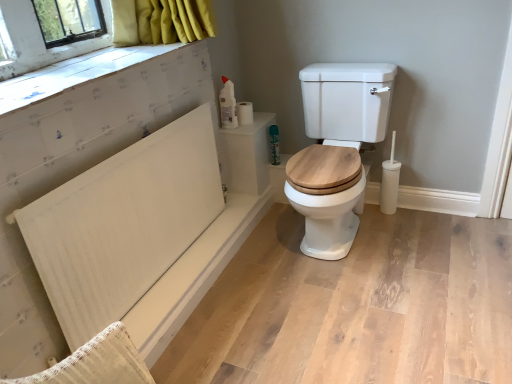
Measure the distance between point (73,70) and camera.

Point (73,70) is 5.11 feet away from camera.

The height and width of the screenshot is (384, 512). What are the coordinates of `white wood toilet at center` in the screenshot? It's located at (337, 150).

Is point (312, 246) more distant than point (98, 208)?

Yes.

Who is taller, white wood toilet at center or white textured radiator at left?

white wood toilet at center.

Considering the relative positions of white wood toilet at center and white textured radiator at left in the image provided, is white wood toilet at center to the left or to the right of white textured radiator at left?

In the image, white wood toilet at center appears on the right side of white textured radiator at left.

Is white wood toilet at center inside or outside of white textured radiator at left?

white wood toilet at center is spatially situated outside white textured radiator at left.

Considering the sizes of white textured board at upper left and white matte toilet paper at upper right, acting as the 1th toilet paper starting from the left, in the image, is white textured board at upper left bigger or smaller than white matte toilet paper at upper right, acting as the 1th toilet paper starting from the left,?

Clearly, white textured board at upper left is larger in size than white matte toilet paper at upper right, acting as the 1th toilet paper starting from the left.

Considering the relative positions of white textured board at upper left and white matte toilet paper at upper right, acting as the 1th toilet paper starting from the left, in the image provided, is white textured board at upper left to the right of white matte toilet paper at upper right, acting as the 1th toilet paper starting from the left, from the viewer's perspective?

No, white textured board at upper left is not to the right of white matte toilet paper at upper right, acting as the 1th toilet paper starting from the left.

Which object is further away from the camera taking this photo, white textured board at upper left or white matte toilet paper at upper right, acting as the 1th toilet paper starting from the left?

white matte toilet paper at upper right, acting as the 1th toilet paper starting from the left, is further from the camera.

Is white textured board at upper left not near white matte toilet paper at upper right, arranged as the second toilet paper when viewed from the right?

No, there isn't a large distance between white textured board at upper left and white matte toilet paper at upper right, arranged as the second toilet paper when viewed from the right.

From the image's perspective, relative to white textured board at upper left, is white matte toilet paper at upper right, which ranks as the second toilet paper in left-to-right order, above or below?

Based on their image positions, white matte toilet paper at upper right, which ranks as the second toilet paper in left-to-right order, is located beneath white textured board at upper left.

Based on the photo, what's the angular difference between white matte toilet paper at upper right, the 1th toilet paper viewed from the right, and white textured board at upper left's facing directions?

0.149 degrees.

This screenshot has height=384, width=512. Identify the location of window sill that is above the white matte toilet paper at upper right, which ranks as the second toilet paper in left-to-right order (from the image's perspective). (74, 74).

Is white matte toilet paper at upper right, which ranks as the second toilet paper in left-to-right order, not near white textured board at upper left?

No, white matte toilet paper at upper right, which ranks as the second toilet paper in left-to-right order, is in close proximity to white textured board at upper left.

Which point is more distant from viewer, (166, 313) or (67, 66)?

The point (166, 313) is behind.

From the image's perspective, is white matte bath at lower left above or below white textured board at upper left?

white matte bath at lower left is below white textured board at upper left.

Which of these two, white matte bath at lower left or white textured board at upper left, is wider?

Wider between the two is white textured board at upper left.

From a real-world perspective, is white matte bath at lower left above or below white textured board at upper left?

From a real-world perspective, white matte bath at lower left is physically below white textured board at upper left.

From the image's perspective, which is below, white textured board at upper left or white matte bath at lower left?

white matte bath at lower left.

Considering their positions, is white textured board at upper left located in front of or behind white matte bath at lower left?

white textured board at upper left is positioned closer to the viewer than white matte bath at lower left.

Is white textured board at upper left spatially inside white matte bath at lower left, or outside of it?

white textured board at upper left is located beyond the bounds of white matte bath at lower left.

Is white textured board at upper left aimed at white matte bath at lower left?

No, white textured board at upper left is not oriented towards white matte bath at lower left.

From the image's perspective, is white matte toilet paper at upper right, which ranks as the second toilet paper in left-to-right order, located above white matte bath at lower left?

Yes, from the image's perspective, white matte toilet paper at upper right, which ranks as the second toilet paper in left-to-right order, is on top of white matte bath at lower left.

From the picture: Does white matte toilet paper at upper right, the 1th toilet paper viewed from the right, appear on the right side of white matte bath at lower left?

Indeed, white matte toilet paper at upper right, the 1th toilet paper viewed from the right, is positioned on the right side of white matte bath at lower left.

From a real-world perspective, is white matte toilet paper at upper right, which ranks as the second toilet paper in left-to-right order, on white matte bath at lower left?

Indeed, from a real-world perspective, white matte toilet paper at upper right, which ranks as the second toilet paper in left-to-right order, stands above white matte bath at lower left.

Is white matte toilet paper at upper right, arranged as the second toilet paper when viewed from the right, taller than white textured board at upper left?

Yes.

Locate an element on the screen. This screenshot has height=384, width=512. toilet paper that is the 1st object directly below the white textured board at upper left (from a real-world perspective) is located at coordinates (233, 107).

In terms of width, does white matte toilet paper at upper right, arranged as the second toilet paper when viewed from the right, look wider or thinner when compared to white textured board at upper left?

white matte toilet paper at upper right, arranged as the second toilet paper when viewed from the right, is thinner than white textured board at upper left.

From a real-world perspective, which object rests below the other?

From a 3D spatial view, white matte toilet paper at upper right, acting as the 1th toilet paper starting from the left, is below.

Find the location of a particular element. This screenshot has height=384, width=512. radiator that appears below the white wood toilet at center (from the image's perspective) is located at coordinates (124, 229).

This screenshot has width=512, height=384. I want to click on window sill that is above the white matte toilet paper at upper right, acting as the 1th toilet paper starting from the left (from a real-world perspective), so click(74, 74).

Which object lies nearer to the anchor point white matte toilet paper at upper right, the 1th toilet paper viewed from the right, white textured radiator at left or white matte toilet paper at upper right, acting as the 1th toilet paper starting from the left?

white matte toilet paper at upper right, acting as the 1th toilet paper starting from the left.

Estimate the real-world distances between objects in this image. Which object is further from white textured board at upper left, white matte toilet paper at upper right, which ranks as the second toilet paper in left-to-right order, or white matte toilet paper at upper right, acting as the 1th toilet paper starting from the left?

Among the two, white matte toilet paper at upper right, which ranks as the second toilet paper in left-to-right order, is located further to white textured board at upper left.

When comparing their distances from white wood toilet at center, does white matte toilet paper at upper right, which ranks as the second toilet paper in left-to-right order, or white matte bath at lower left seem further?

white matte toilet paper at upper right, which ranks as the second toilet paper in left-to-right order.

When comparing their distances from white wood toilet at center, does white textured radiator at left or white matte bath at lower left seem closer?

white matte bath at lower left is positioned closer to the anchor white wood toilet at center.

When comparing their distances from white matte bath at lower left, does white textured board at upper left or white textured radiator at left seem further?

white textured board at upper left is positioned further to the anchor white matte bath at lower left.

From the image, which object appears to be nearer to white matte toilet paper at upper right, which ranks as the second toilet paper in left-to-right order, white matte toilet paper at upper right, arranged as the second toilet paper when viewed from the right, or white textured board at upper left?

white matte toilet paper at upper right, arranged as the second toilet paper when viewed from the right.

When comparing their distances from white matte bath at lower left, does white textured radiator at left or green matte spray can at upper right seem further?

The object further to white matte bath at lower left is green matte spray can at upper right.

Consider the image. Based on their spatial positions, is white matte toilet paper at upper right, arranged as the second toilet paper when viewed from the right, or white matte toilet paper at upper right, which ranks as the second toilet paper in left-to-right order, further from white matte bath at lower left?

white matte toilet paper at upper right, which ranks as the second toilet paper in left-to-right order.

The width and height of the screenshot is (512, 384). Identify the location of toilet positioned between white textured board at upper left and white matte toilet paper at upper right, the 1th toilet paper viewed from the right, from near to far. (337, 150).

Locate an element on the screen. The image size is (512, 384). bath positioned between white textured radiator at left and green matte spray can at upper right from near to far is located at coordinates (193, 275).

Identify the location of toilet paper that lies between white matte toilet paper at upper right, acting as the 1th toilet paper starting from the left, and white matte bath at lower left from top to bottom. Image resolution: width=512 pixels, height=384 pixels. (244, 113).

The width and height of the screenshot is (512, 384). Identify the location of window sill between white textured radiator at left and green matte spray can at upper right along the z-axis. (74, 74).